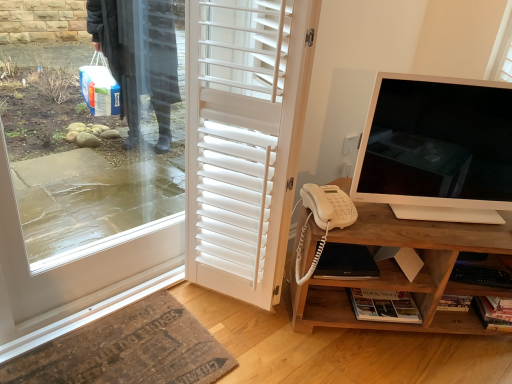
The image size is (512, 384). I want to click on vacant area located to the right-hand side of rug at lower left, so click(x=271, y=342).